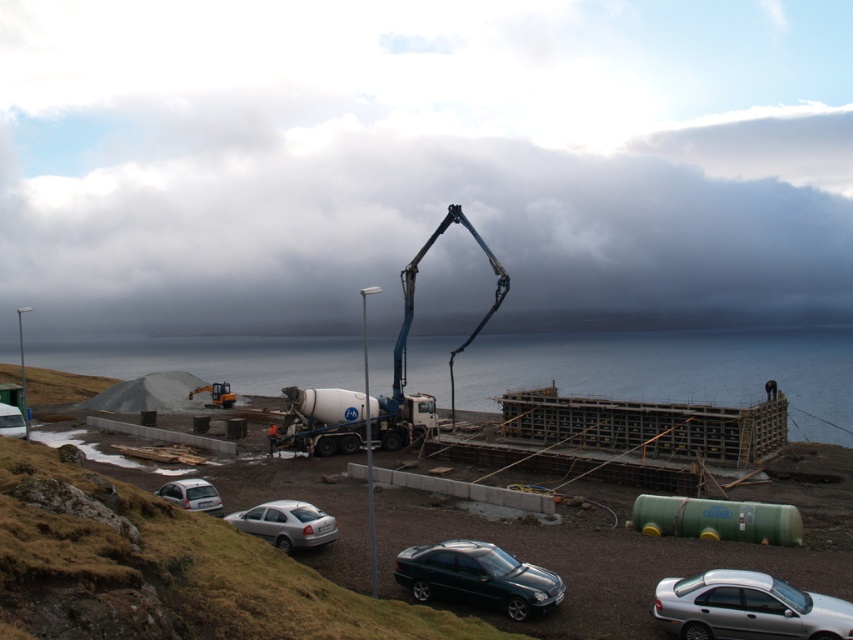
You are a delivery driver who needs to park your truck in the construction site parking area. You see the silver metallic car at lower right and the silver metallic sedan at lower center. Which vehicle should you avoid parking next to if you want to leave first?

You should avoid parking next to the silver metallic car at lower right because it is shorter than the silver metallic sedan at lower center, so the shorter vehicle might be easier to maneuver around.

Consider the image. You are a construction supervisor looking at the site layout. Which object, the cloudy sky at upper center or the white concrete mixer at center, is positioned higher in the image?

The cloudy sky at upper center is positioned higher than the white concrete mixer at center in the image.